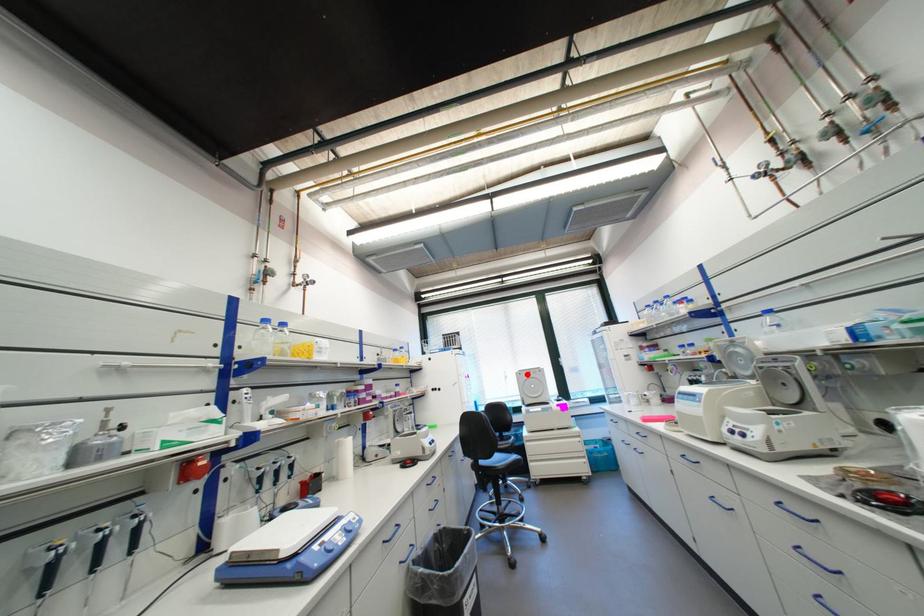
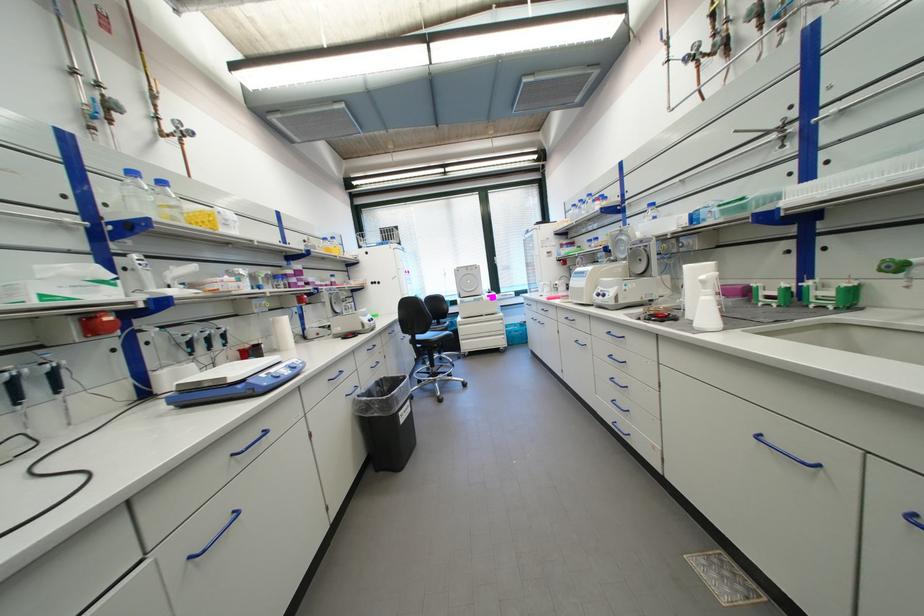
The point at the highlighted location is marked in the first image. Where is the corresponding point in the second image?

(466, 272)